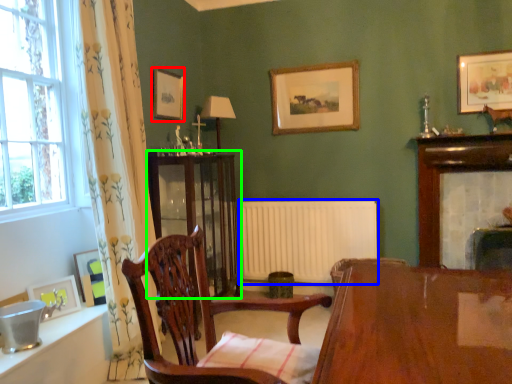
Question: Which object is positioned closest to picture frame (highlighted by a red box)? Select from radiator (highlighted by a blue box) and cabinetry (highlighted by a green box).

Choices:
 (A) radiator
 (B) cabinetry

Answer: (B)